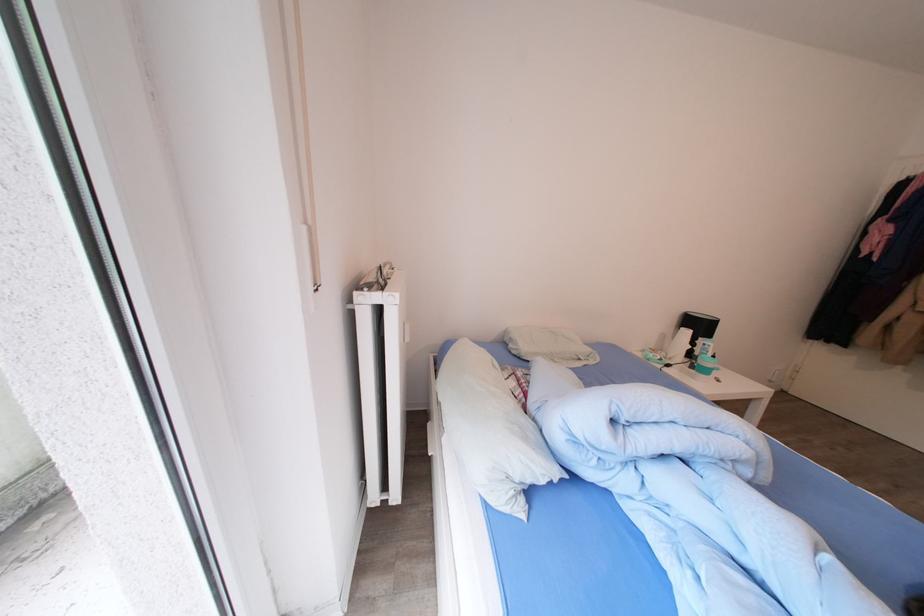
You are a GUI agent. You are given a task and a screenshot of the screen. Output one action in this format:
    pyautogui.click(x=<x>, y=<y>)
    Task: Click on the black lamp
    The image size is (924, 616).
    Given the screenshot: What is the action you would take?
    pyautogui.click(x=690, y=334)